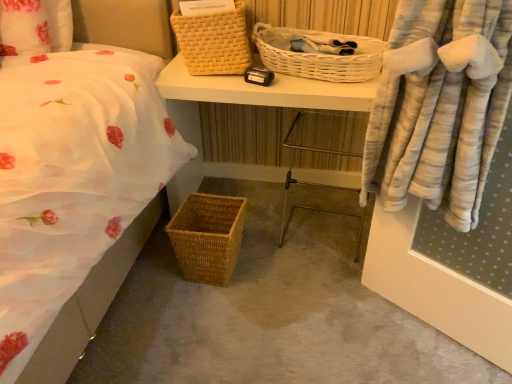
Locate an element on the screen. This screenshot has height=384, width=512. free space in front of woven wood desk at center is located at coordinates (269, 306).